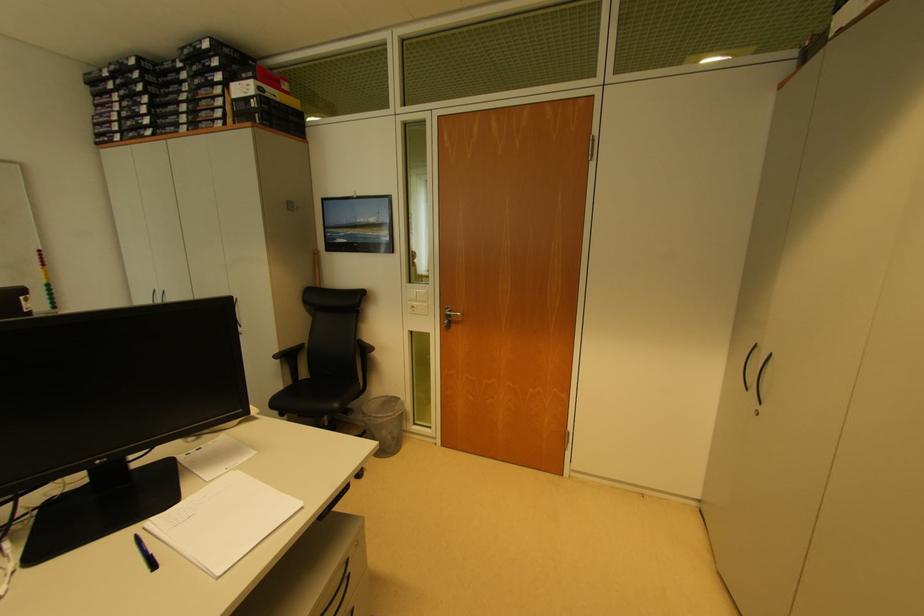
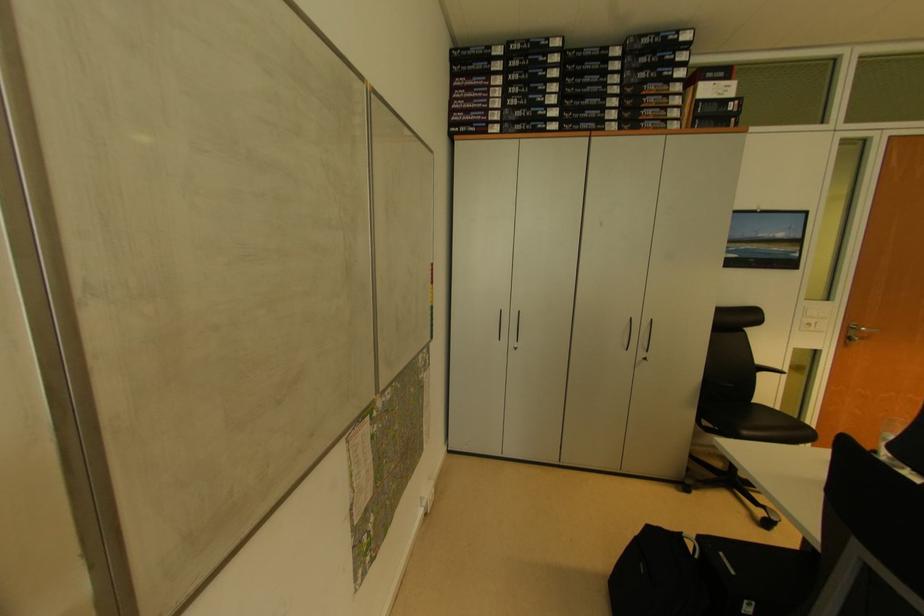
The point at (202, 126) is marked in the first image. Where is the corresponding point in the second image?

(646, 124)